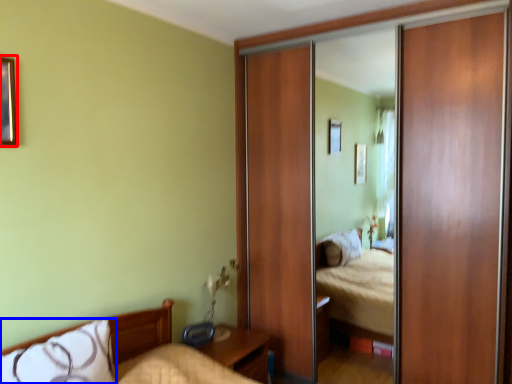
Question: Which object is closer to the camera taking this photo, picture frame (highlighted by a red box) or pillow (highlighted by a blue box)?

Choices:
 (A) picture frame
 (B) pillow

Answer: (B)